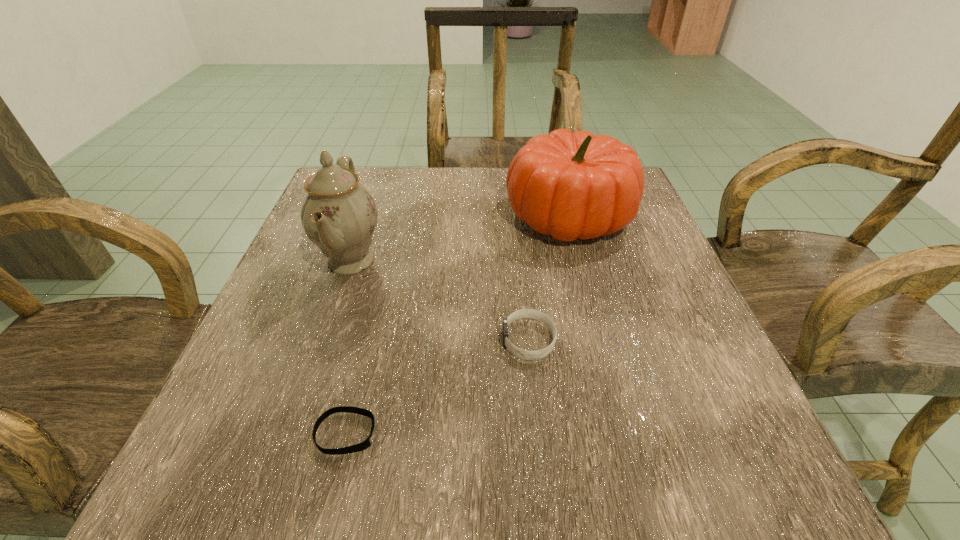
What are the coordinates of `chinaware` in the screenshot? It's located at pyautogui.click(x=338, y=214).

The width and height of the screenshot is (960, 540). Identify the location of pumpkin. (568, 185).

Where is `the right wristband`? the right wristband is located at coordinates (523, 313).

Find the location of a particular element. The image size is (960, 540). the farther wristband is located at coordinates (523, 313).

Find the location of `the nearer wristband`. the nearer wristband is located at coordinates (365, 444).

Identify the location of the shortest object. (365, 444).

Where is `free region located on the spout of the chinaware`? free region located on the spout of the chinaware is located at coordinates (430, 261).

The image size is (960, 540). Identify the location of vacant region located on the front of the third shortest object. (619, 410).

You are a GUI agent. You are given a task and a screenshot of the screen. Output one action in this format:
    pyautogui.click(x=<x>, y=<y>)
    Task: Click on the vacant space situated 0.280m on the outer surface of the third tallest object
    
    Given the screenshot: What is the action you would take?
    pyautogui.click(x=331, y=340)

The image size is (960, 540). I want to click on free space located 0.220m on the outer surface of the third tallest object, so click(x=368, y=340).